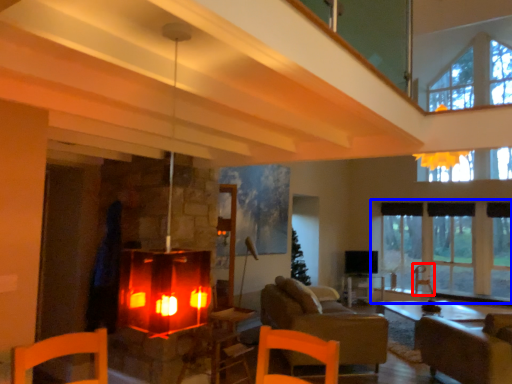
Question: Which point is closer to the camera, armchair (highlighted by a red box) or window (highlighted by a blue box)?

Choices:
 (A) armchair
 (B) window

Answer: (B)